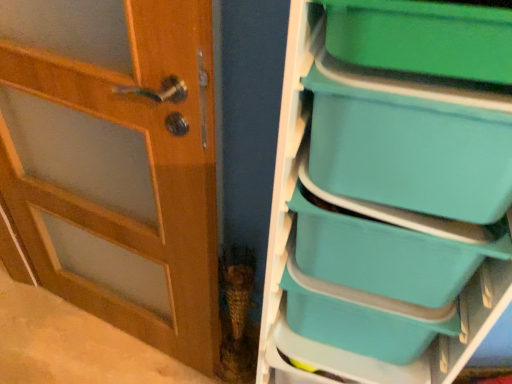
Question: Can you confirm if green plastic storage box at upper right, the first storage box in the top-to-bottom sequence, is smaller than wooden door at left?

Choices:
 (A) no
 (B) yes

Answer: (B)

Question: Are green plastic storage box at upper right, the first storage box in the top-to-bottom sequence, and wooden door at left making contact?

Choices:
 (A) no
 (B) yes

Answer: (A)

Question: From the image's perspective, is green plastic storage box at upper right, the first storage box in the top-to-bottom sequence, located above wooden door at left?

Choices:
 (A) yes
 (B) no

Answer: (A)

Question: Considering the relative sizes of green plastic storage box at upper right, the first storage box in the top-to-bottom sequence, and wooden door at left in the image provided, is green plastic storage box at upper right, the first storage box in the top-to-bottom sequence, wider than wooden door at left?

Choices:
 (A) no
 (B) yes

Answer: (B)

Question: From the image's perspective, is green plastic storage box at upper right, the 4th storage box positioned from the bottom, located beneath wooden door at left?

Choices:
 (A) no
 (B) yes

Answer: (A)

Question: Is green plastic storage box at upper right, the 4th storage box positioned from the bottom, positioned with its back to wooden door at left?

Choices:
 (A) yes
 (B) no

Answer: (B)

Question: From a real-world perspective, is teal plastic storage bins at right positioned over teal plastic storage box at right, which ranks as the second storage box in bottom-to-top order, based on gravity?

Choices:
 (A) yes
 (B) no

Answer: (B)

Question: From a real-world perspective, is teal plastic storage bins at right under teal plastic storage box at right, which ranks as the second storage box in bottom-to-top order?

Choices:
 (A) no
 (B) yes

Answer: (B)

Question: Is teal plastic storage bins at right smaller than teal plastic storage box at right, which ranks as the 3th storage box in top-to-bottom order?

Choices:
 (A) no
 (B) yes

Answer: (A)

Question: Is teal plastic storage bins at right thinner than teal plastic storage box at right, which ranks as the second storage box in bottom-to-top order?

Choices:
 (A) yes
 (B) no

Answer: (B)

Question: Is teal plastic storage bins at right wider than teal plastic storage box at right, which ranks as the second storage box in bottom-to-top order?

Choices:
 (A) no
 (B) yes

Answer: (B)

Question: Is teal plastic storage bins at right positioned beyond the bounds of teal plastic storage box at right, which ranks as the 3th storage box in top-to-bottom order?

Choices:
 (A) yes
 (B) no

Answer: (A)

Question: Is teal plastic storage box at right, marked as the first storage box in a bottom-to-top arrangement, at the right side of green plastic storage box at upper right, the 4th storage box positioned from the bottom?

Choices:
 (A) no
 (B) yes

Answer: (B)